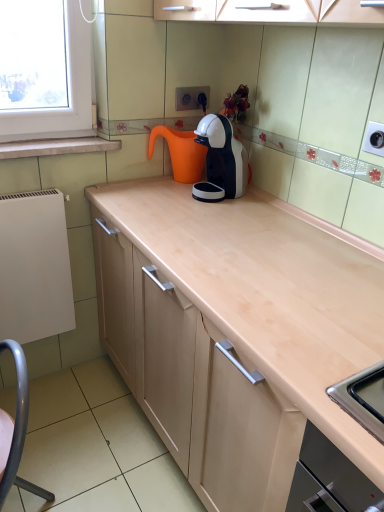
Identify the location of white matte radiator at left. (34, 267).

The width and height of the screenshot is (384, 512). Describe the element at coordinates (181, 153) in the screenshot. I see `orange matte water jug at center` at that location.

The height and width of the screenshot is (512, 384). In order to click on metallic gray swivel chair at lower left in this screenshot , I will do `click(19, 430)`.

What is the approximate height of white marble window sill at upper left?

The height of white marble window sill at upper left is 4.71 inches.

Image resolution: width=384 pixels, height=512 pixels. In order to click on white matte radiator at left in this screenshot , I will do `click(34, 267)`.

Considering the positions of point (151, 152) and point (242, 145), is point (151, 152) closer or farther from the camera than point (242, 145)?

Point (151, 152) is positioned farther from the camera compared to point (242, 145).

Is orange matte water jug at center situated inside white glossy coffee machine at upper center or outside?

orange matte water jug at center cannot be found inside white glossy coffee machine at upper center.

Are orange matte water jug at center and white glossy coffee machine at upper center beside each other?

orange matte water jug at center and white glossy coffee machine at upper center are not in contact.

From the picture: Can you confirm if orange matte water jug at center is smaller than white glossy coffee machine at upper center?

Incorrect, orange matte water jug at center is not smaller in size than white glossy coffee machine at upper center.

Is white marble window sill at upper left further to camera compared to metallic gray swivel chair at lower left?

Yes, it is.

Which is in front, point (57, 142) or point (23, 396)?

The point (23, 396) is closer to the camera.

This screenshot has width=384, height=512. Find the location of `window sill above the metallic gray swivel chair at lower left (from a real-world perspective)`. window sill above the metallic gray swivel chair at lower left (from a real-world perspective) is located at coordinates (57, 147).

From the image's perspective, is white marble window sill at upper left located above or below metallic gray swivel chair at lower left?

Based on their image positions, white marble window sill at upper left is located above metallic gray swivel chair at lower left.

Is white matte radiator at left at the back of metallic gray swivel chair at lower left?

metallic gray swivel chair at lower left does not have its back to white matte radiator at left.

Which object is wider, metallic gray swivel chair at lower left or white matte radiator at left?

metallic gray swivel chair at lower left.

Does metallic gray swivel chair at lower left have a smaller size compared to white matte radiator at left?

No.

Is metallic gray swivel chair at lower left taller or shorter than white matte radiator at left?

Considering their sizes, metallic gray swivel chair at lower left has more height than white matte radiator at left.

In the image, is orange matte water jug at center on the left side or the right side of white matte radiator at left?

From the image, it's evident that orange matte water jug at center is to the right of white matte radiator at left.

Does orange matte water jug at center touch white matte radiator at left?

orange matte water jug at center is not next to white matte radiator at left, and they're not touching.

Is orange matte water jug at center smaller than white matte radiator at left?

Yes.

From a real-world perspective, which is physically below, orange matte water jug at center or white matte radiator at left?

In real-world perspective, white matte radiator at left is lower.

Is white matte radiator at left facing towards white marble window sill at upper left?

No, white matte radiator at left is not aimed at white marble window sill at upper left.

Considering the relative positions of white matte radiator at left and white marble window sill at upper left in the image provided, is white matte radiator at left behind white marble window sill at upper left?

No, it is in front of white marble window sill at upper left.

Based on the photo, between white matte radiator at left and white marble window sill at upper left, which one has smaller width?

Thinner between the two is white matte radiator at left.

Is white matte radiator at left beside white marble window sill at upper left?

They are not placed beside each other.

Is white glossy coffee machine at upper center inside or outside of orange matte water jug at center?

white glossy coffee machine at upper center is spatially situated outside orange matte water jug at center.

In the scene shown: Can you tell me how much white glossy coffee machine at upper center and orange matte water jug at center differ in facing direction?

4.67 degrees separate the facing orientations of white glossy coffee machine at upper center and orange matte water jug at center.

In the image, there is a white glossy coffee machine at upper center. Find the location of `coffeepot above it (from the image's perspective)`. coffeepot above it (from the image's perspective) is located at coordinates (181, 153).

From a real-world perspective, between white glossy coffee machine at upper center and orange matte water jug at center, who is vertically lower?

orange matte water jug at center.

Consider the image. Between orange matte water jug at center and metallic gray swivel chair at lower left, which one appears on the right side from the viewer's perspective?

Positioned to the right is orange matte water jug at center.

Does point (174, 140) come farther from viewer compared to point (8, 342)?

Yes, point (174, 140) is farther from viewer.

How different are the orientations of orange matte water jug at center and metallic gray swivel chair at lower left in degrees?

3.67 degrees separate the facing orientations of orange matte water jug at center and metallic gray swivel chair at lower left.

Considering the relative sizes of orange matte water jug at center and metallic gray swivel chair at lower left in the image provided, is orange matte water jug at center smaller than metallic gray swivel chair at lower left?

Yes.

This screenshot has height=512, width=384. In order to click on kitchen appliance on the right of orange matte water jug at center in this screenshot , I will do `click(224, 155)`.

In the image, there is a metallic gray swivel chair at lower left. Identify the location of window sill above it (from the image's perspective). (57, 147).

Based on their spatial positions, is orange matte water jug at center or white marble window sill at upper left closer to metallic gray swivel chair at lower left?

Among the two, white marble window sill at upper left is located nearer to metallic gray swivel chair at lower left.

From the image, which object appears to be nearer to white glossy coffee machine at upper center, orange matte water jug at center or white marble window sill at upper left?

orange matte water jug at center is positioned closer to the anchor white glossy coffee machine at upper center.

Which object lies further to the anchor point white glossy coffee machine at upper center, orange matte water jug at center or white matte radiator at left?

The object further to white glossy coffee machine at upper center is white matte radiator at left.

Looking at the image, which one is located closer to metallic gray swivel chair at lower left, white marble window sill at upper left or white matte radiator at left?

white matte radiator at left.

From the picture: When comparing their distances from orange matte water jug at center, does white matte radiator at left or white marble window sill at upper left seem closer?

white marble window sill at upper left is closer to orange matte water jug at center.

Based on their spatial positions, is white glossy coffee machine at upper center or orange matte water jug at center further from metallic gray swivel chair at lower left?

The object further to metallic gray swivel chair at lower left is orange matte water jug at center.

Which object lies nearer to the anchor point white matte radiator at left, metallic gray swivel chair at lower left or white glossy coffee machine at upper center?

The object closer to white matte radiator at left is metallic gray swivel chair at lower left.

Estimate the real-world distances between objects in this image. Which object is closer to orange matte water jug at center, white marble window sill at upper left or white matte radiator at left?

white marble window sill at upper left lies closer to orange matte water jug at center than the other object.

Identify the location of appliance between white glossy coffee machine at upper center and metallic gray swivel chair at lower left in the vertical direction. The height and width of the screenshot is (512, 384). (34, 267).

Where is `kitchen appliance between orange matte water jug at center and metallic gray swivel chair at lower left from top to bottom`? kitchen appliance between orange matte water jug at center and metallic gray swivel chair at lower left from top to bottom is located at coordinates (224, 155).

What are the coordinates of `kitchen appliance between white marble window sill at upper left and metallic gray swivel chair at lower left from top to bottom` in the screenshot? It's located at (224, 155).

Locate an element on the screen. The height and width of the screenshot is (512, 384). appliance that lies between orange matte water jug at center and metallic gray swivel chair at lower left from top to bottom is located at coordinates (34, 267).